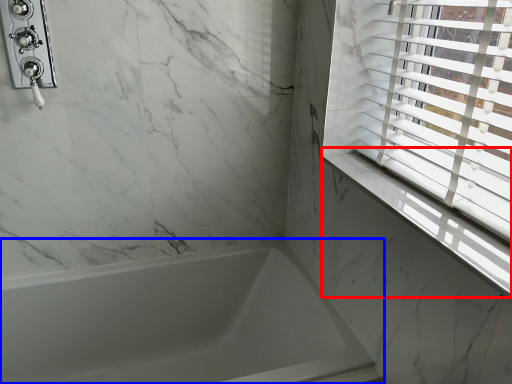
Question: Among these objects, which one is nearest to the camera, window sill (highlighted by a red box) or bathtub (highlighted by a blue box)?

Choices:
 (A) window sill
 (B) bathtub

Answer: (A)